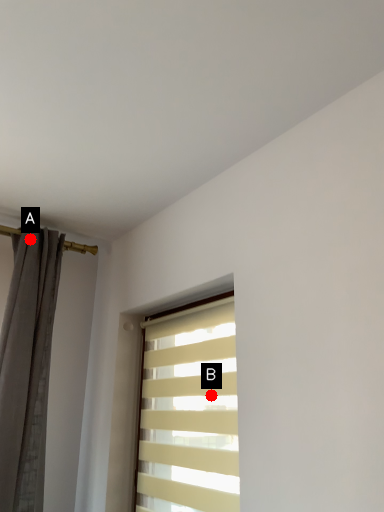
Question: Two points are circled on the image, labeled by A and B beside each circle. Which point is farther to the camera?

Choices:
 (A) A is further
 (B) B is further

Answer: (A)